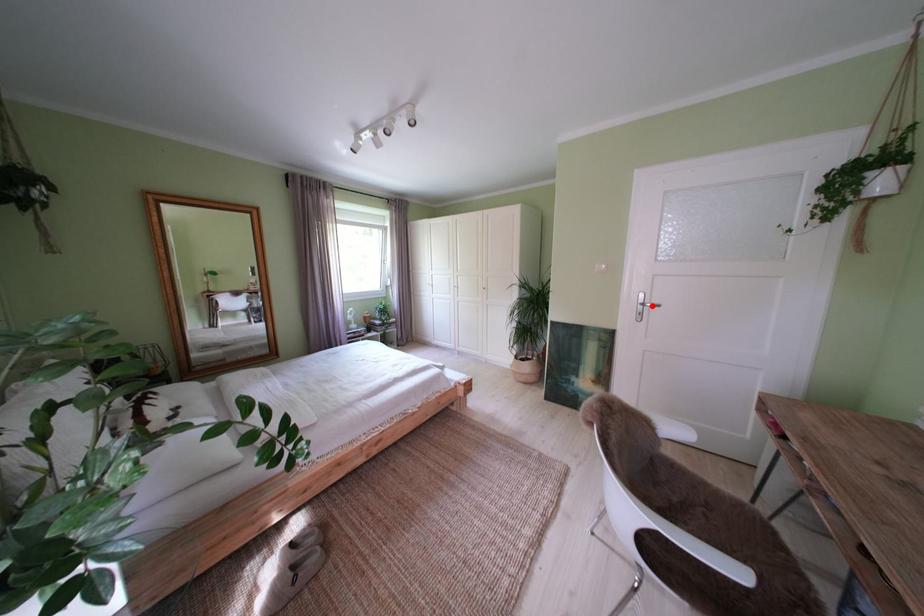
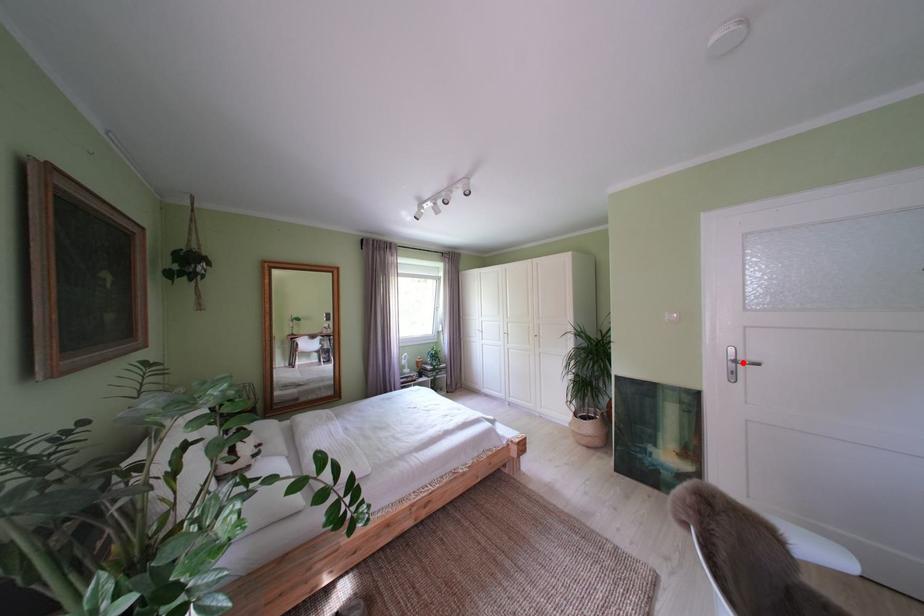
I am providing you with two images of the same scene from different viewpoints. A red point is marked on the first image and another point is marked on the second image. Are the points marked in image1 and image2 representing the same 3D position?

Yes